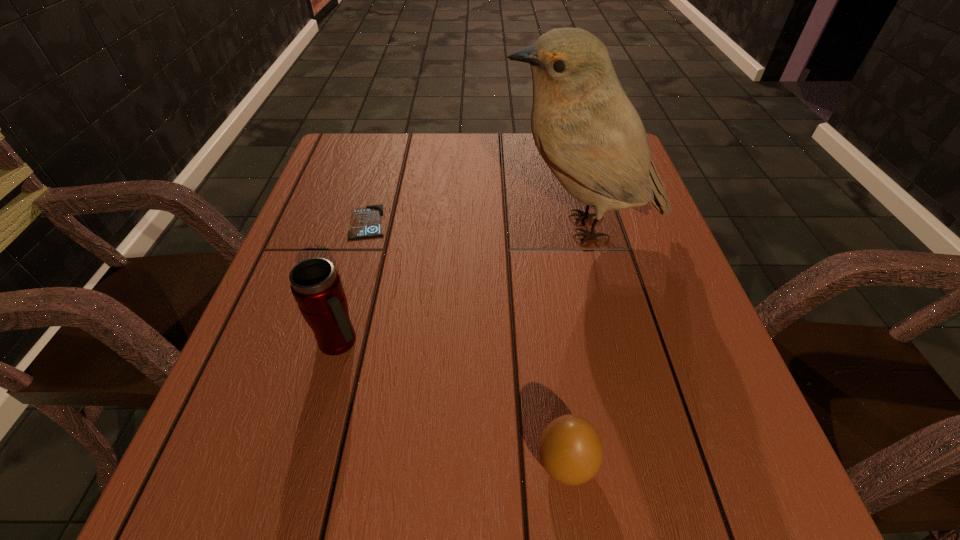
In the image, there is a desktop. Where is `vacant space at the far left corner`? vacant space at the far left corner is located at coordinates (378, 136).

Image resolution: width=960 pixels, height=540 pixels. In order to click on vacant space at the near left corner of the desktop in this screenshot , I will do `click(238, 528)`.

Identify the location of vacant space at the near right corner. (738, 518).

This screenshot has width=960, height=540. In order to click on empty space that is in between the parakeet and the identity card in this screenshot , I will do `click(475, 225)`.

The image size is (960, 540). Identify the location of unoccupied position between the shortest object and the tallest object. (475, 225).

This screenshot has width=960, height=540. Identify the location of free spot between the boiled egg and the parakeet. (574, 346).

This screenshot has height=540, width=960. In order to click on free space between the boiled egg and the shortest object in this screenshot , I will do [467, 343].

Image resolution: width=960 pixels, height=540 pixels. Identify the location of free point between the shortest object and the boiled egg. (467, 343).

Identify the location of vacant area between the parakeet and the second nearest object. (461, 284).

Where is `empty location between the nearest object and the parakeet`? Image resolution: width=960 pixels, height=540 pixels. empty location between the nearest object and the parakeet is located at coordinates tap(574, 346).